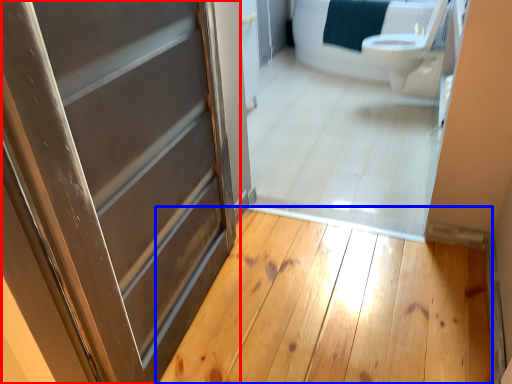
Question: Which object appears closest to the camera in this image, door (highlighted by a red box) or plank (highlighted by a blue box)?

Choices:
 (A) door
 (B) plank

Answer: (A)